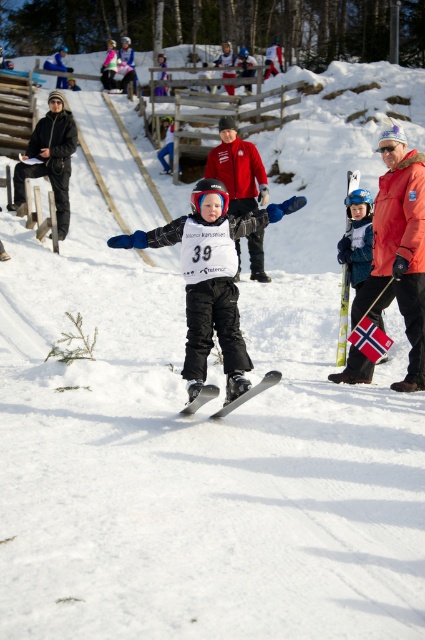
Can you confirm if matte black snowboard at center is taller than matte black skis at center?

Yes, matte black snowboard at center is taller than matte black skis at center.

Between matte black snowboard at center and matte black skis at center, which one has less height?

Standing shorter between the two is matte black skis at center.

Between point (260, 220) and point (226, 408), which one is positioned in front?

Point (226, 408) is more forward.

You are a GUI agent. You are given a task and a screenshot of the screen. Output one action in this format:
    pyautogui.click(x=<x>, y=<y>)
    Task: Click on the matte black snowboard at center
    
    Given the screenshot: What is the action you would take?
    pyautogui.click(x=209, y=280)

Can you confirm if matte black snowboard at center is positioned to the left of yellow metallic ski at right?

Indeed, matte black snowboard at center is positioned on the left side of yellow metallic ski at right.

Image resolution: width=425 pixels, height=640 pixels. What do you see at coordinates (209, 280) in the screenshot? I see `matte black snowboard at center` at bounding box center [209, 280].

This screenshot has width=425, height=640. I want to click on matte black snowboard at center, so click(209, 280).

Measure the distance between yellow metallic ski at right and camera.

7.98 meters

Where is `yellow metallic ski at right`? This screenshot has width=425, height=640. yellow metallic ski at right is located at coordinates (342, 316).